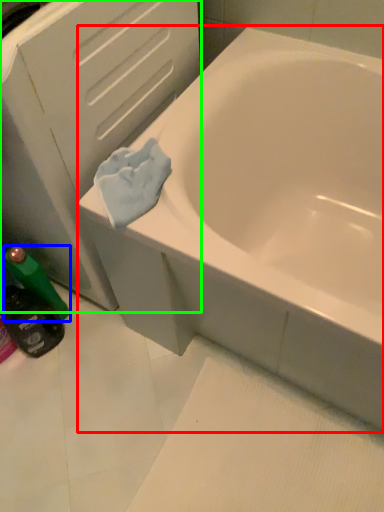
Question: Which object is the farthest from bathtub (highlighted by a red box)? Choose among these: mouthwash (highlighted by a blue box) or file cabinet (highlighted by a green box).

Choices:
 (A) mouthwash
 (B) file cabinet

Answer: (A)